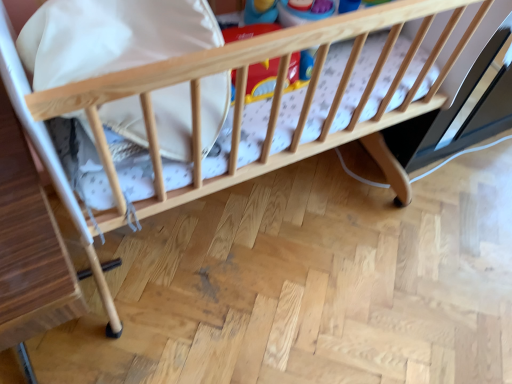
Find the location of a particular element. The width and height of the screenshot is (512, 384). white matte pillow at upper left is located at coordinates (111, 37).

What is the approximate height of white matte pillow at upper left?

It is 8.89 inches.

This screenshot has width=512, height=384. What do you see at coordinates (111, 37) in the screenshot?
I see `white matte pillow at upper left` at bounding box center [111, 37].

Locate an element on the screen. white matte pillow at upper left is located at coordinates (111, 37).